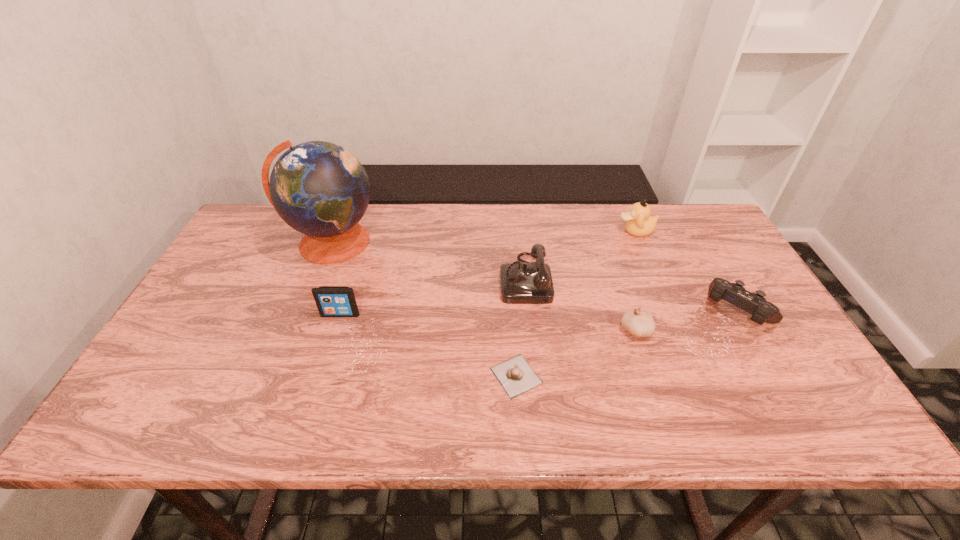
The image size is (960, 540). In order to click on vacant region located 0.230m on the face of the duckling in this screenshot , I will do `click(545, 231)`.

Image resolution: width=960 pixels, height=540 pixels. Identify the location of vacant space situated on the face of the duckling. (492, 231).

Locate an element on the screen. free space located on the face of the duckling is located at coordinates (576, 231).

Where is `free space located on the dial of the telephone`? This screenshot has height=540, width=960. free space located on the dial of the telephone is located at coordinates (359, 279).

I want to click on vacant region located on the dial of the telephone, so click(x=471, y=279).

Where is `vacant region located 0.340m on the dial of the telephone`? vacant region located 0.340m on the dial of the telephone is located at coordinates (380, 279).

This screenshot has height=540, width=960. What are the coordinates of `vacant space located 0.210m on the front screen of the iPod` in the screenshot? It's located at (318, 388).

At what (x,y) coordinates should I click in order to perform the action: click on free location located 0.070m on the front of the control. Please return your answer as a coordinate pair (x, y). This screenshot has height=540, width=960. Looking at the image, I should click on (766, 361).

The width and height of the screenshot is (960, 540). Identify the location of vacant space situated 0.200m on the back of the right garlic. (614, 267).

What are the coordinates of `blank area located 0.120m on the back of the left garlic` in the screenshot? It's located at (512, 316).